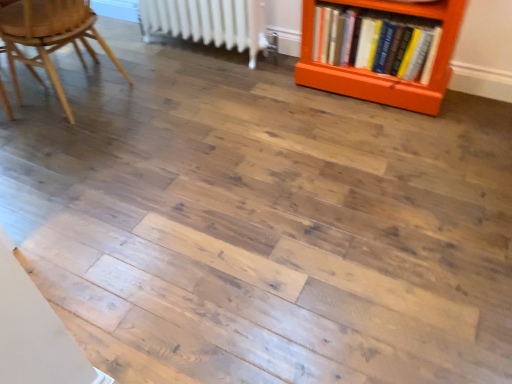
Question: Should I look upward or downward to see wooden chair at left?

Choices:
 (A) down
 (B) up

Answer: (B)

Question: Is hardcover books at right in contact with wooden chair at left?

Choices:
 (A) no
 (B) yes

Answer: (A)

Question: Is hardcover books at right not inside wooden chair at left?

Choices:
 (A) no
 (B) yes

Answer: (B)

Question: From the image's perspective, does hardcover books at right appear higher than wooden chair at left?

Choices:
 (A) yes
 (B) no

Answer: (A)

Question: From a real-world perspective, is hardcover books at right physically above wooden chair at left?

Choices:
 (A) no
 (B) yes

Answer: (A)

Question: Considering the relative sizes of hardcover books at right and wooden chair at left in the image provided, is hardcover books at right smaller than wooden chair at left?

Choices:
 (A) yes
 (B) no

Answer: (A)

Question: Would you say wooden chair at left is part of hardcover books at right's contents?

Choices:
 (A) no
 (B) yes

Answer: (A)

Question: From the image's perspective, is wooden chair at left over white metallic radiator at upper center?

Choices:
 (A) yes
 (B) no

Answer: (B)

Question: From a real-world perspective, is wooden chair at left on white metallic radiator at upper center?

Choices:
 (A) yes
 (B) no

Answer: (A)

Question: From the image's perspective, is wooden chair at left located beneath white metallic radiator at upper center?

Choices:
 (A) yes
 (B) no

Answer: (A)

Question: Is there a large distance between wooden chair at left and white metallic radiator at upper center?

Choices:
 (A) no
 (B) yes

Answer: (A)

Question: Is wooden chair at left wider than white metallic radiator at upper center?

Choices:
 (A) no
 (B) yes

Answer: (B)

Question: Considering the relative sizes of wooden chair at left and white metallic radiator at upper center in the image provided, is wooden chair at left taller than white metallic radiator at upper center?

Choices:
 (A) no
 (B) yes

Answer: (B)

Question: Can you confirm if white metallic radiator at upper center is bigger than hardcover books at right?

Choices:
 (A) no
 (B) yes

Answer: (B)